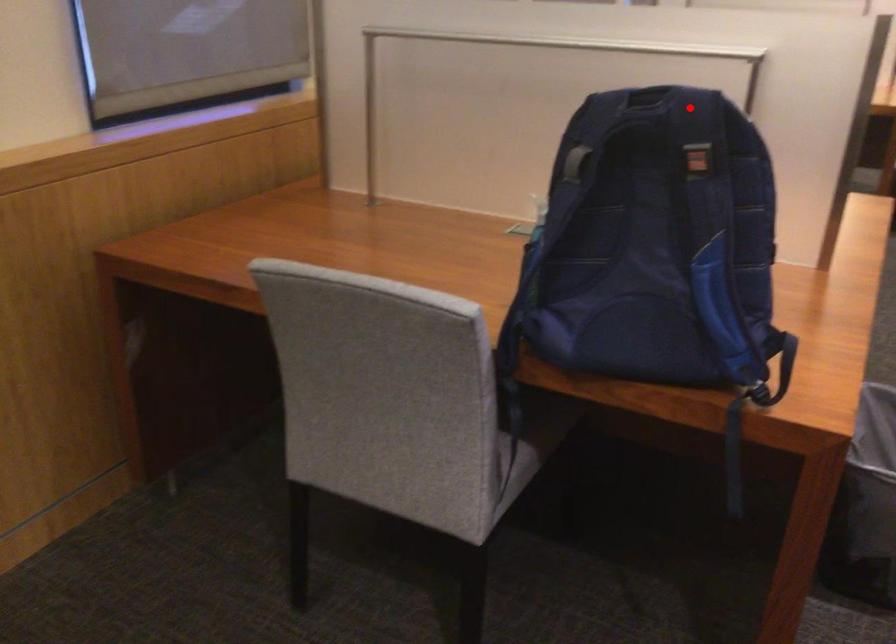
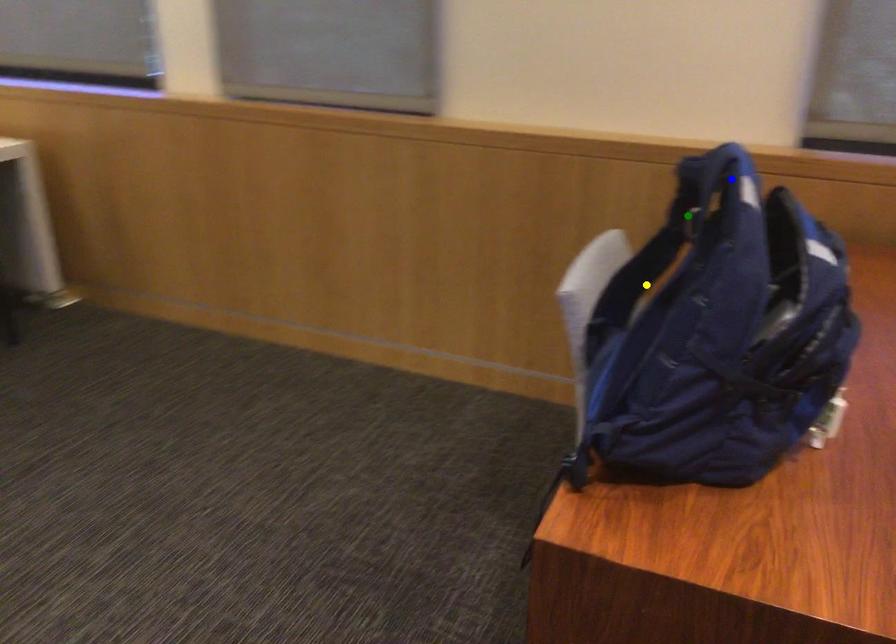
Question: I am providing you with two images of the same scene from different viewpoints. A red point is marked on the first image. You are given multiple points on the second image. Which spot in image 2 lines up with the point in image 1?

Choices:
 (A) yellow point
 (B) blue point
 (C) green point

Answer: (B)